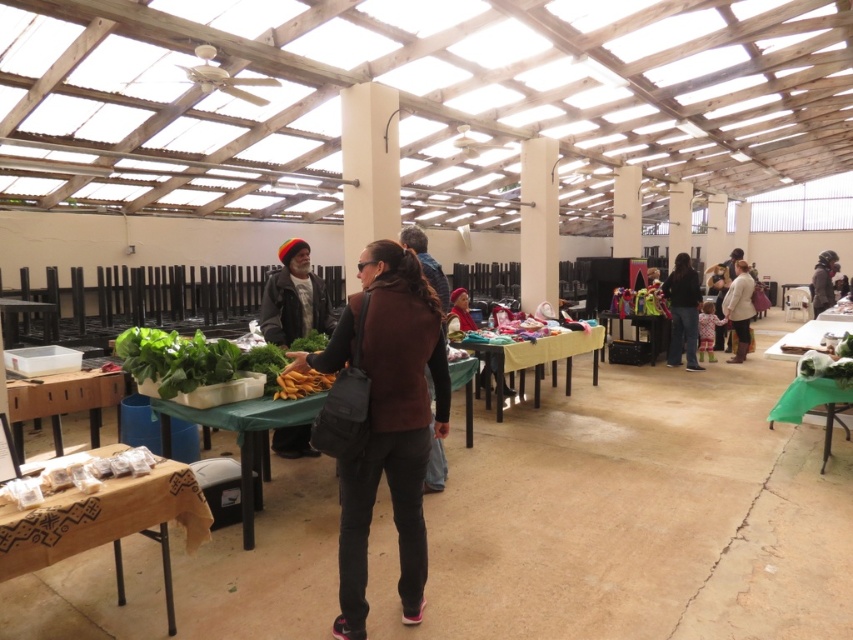
Which is behind, point (514, 348) or point (809, 340)?

The point (514, 348) is more distant.

Which is below, yellow fabric table at center or green fabric table at right?

yellow fabric table at center

This screenshot has height=640, width=853. Identify the location of yellow fabric table at center. (534, 358).

What are the coordinates of `yellow fabric table at center` in the screenshot? It's located at (534, 358).

Is point (405, 369) more distant than point (285, 372)?

That is False.

Which of these two, matte black jacket at center or yellow matte carrots at center, stands taller?

matte black jacket at center is taller.

Is point (398, 284) positioned behind point (312, 374)?

No, (398, 284) is closer to viewer.

Locate an element on the screen. matte black jacket at center is located at coordinates (387, 420).

Which is behind, point (349, 593) or point (737, 324)?

The point (737, 324) is more distant.

I want to click on matte black jacket at center, so click(x=387, y=420).

Which is in front, point (416, 396) or point (737, 280)?

Point (416, 396) is in front.

Where is `matte black jacket at center`? Image resolution: width=853 pixels, height=640 pixels. matte black jacket at center is located at coordinates (387, 420).